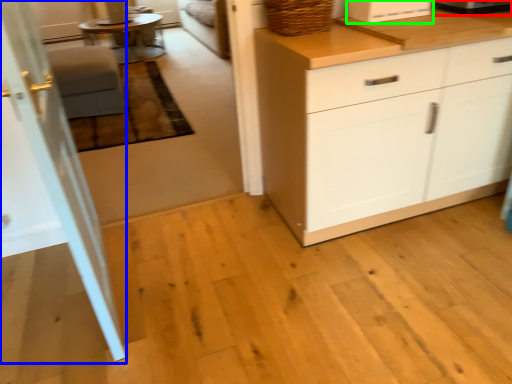
Question: Estimate the real-world distances between objects in this image. Which object is closer to appliance (highlighted by a red box), screen door (highlighted by a blue box) or appliance (highlighted by a green box)?

Choices:
 (A) screen door
 (B) appliance

Answer: (B)